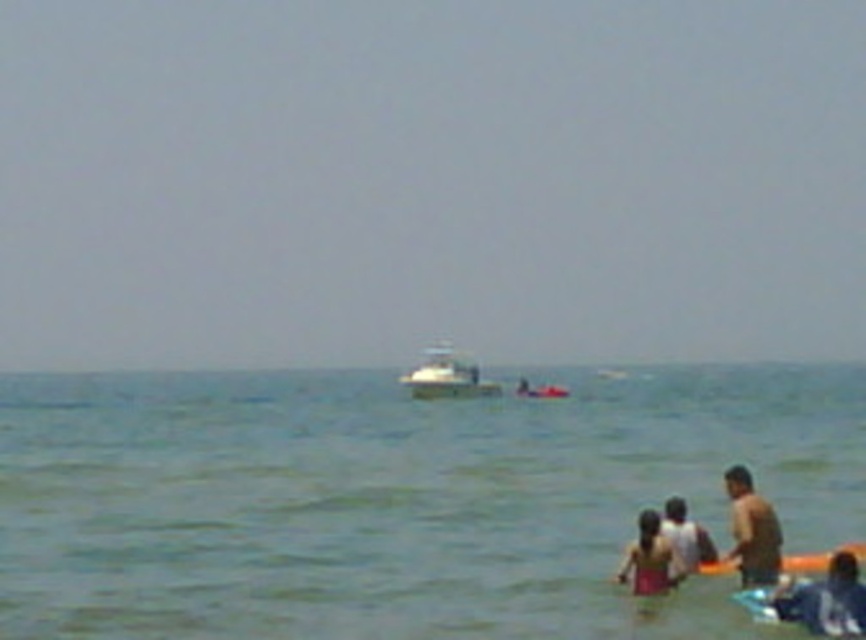
From the picture: You are a photographer standing at the beach and want to capture both the blue fabric shirt at lower right and the white glossy boat at center in a single photo. Which object should you focus on first to ensure both are in the frame?

The blue fabric shirt at lower right is located below the white glossy boat at center, so you should focus on the white glossy boat at center first to ensure both are included in the frame.

You are a photographer trying to capture a wide shot of the beach scene. You want to ensure that both the clear blue water at center and the white glossy boat at center are visible in your photo. Based on their sizes in the image, which object will occupy more of the frame?

The clear blue water at center is bigger than the white glossy boat at center, so it will occupy more of the frame in the photo.

You are standing on the beach and want to locate the clear blue water at center. According to the coordinates provided, where should you look?

The clear blue water at center is located at coordinates point (399, 499).